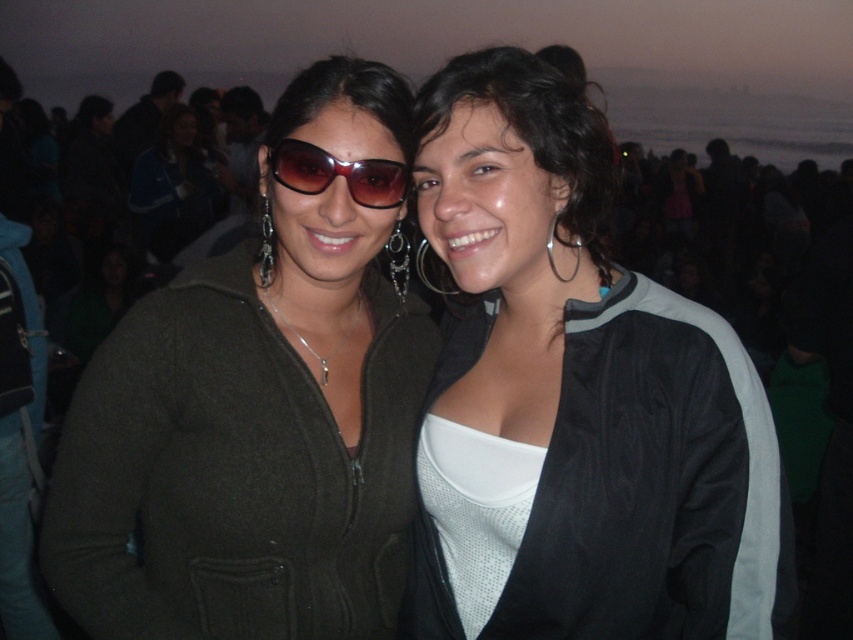
You are a photographer trying to capture a closeup shot of both the black fabric jacket at center and the sunglasses at center. Given that your camera can only focus on objects within a 15 inch range, will both items be in focus?

The black fabric jacket at center and sunglasses at center are 14.91 inches apart from each other, so yes, both items will be in focus since the distance between them is within the camera focus range of 15 inches.

You are a photographer trying to adjust the lighting for a portrait. You notice two items at the center of the image. Which one is positioned to the right of the other? The items are the black fabric jacket at center and the sunglasses at center.

The black fabric jacket at center is to the right of the sunglasses at center.

You are a photographer holding a camera that requires a minimum distance of 1.5 meters to focus properly. You are taking a photo of the black fabric jacket at center. Will your camera be able to focus on the jacket?

The black fabric jacket at center is only 1.22 meters away from the viewer, which is less than the camera requirement of 1.5 meters. Therefore, the camera will not be able to focus properly on the jacket.